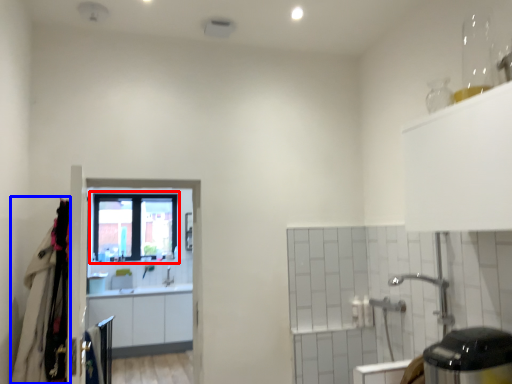
Question: Which object is further to the camera taking this photo, window (highlighted by a red box) or laundry (highlighted by a blue box)?

Choices:
 (A) window
 (B) laundry

Answer: (A)